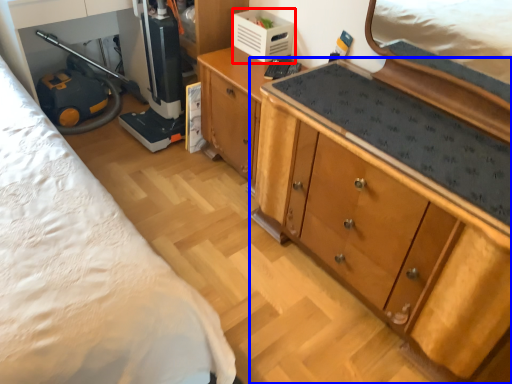
Question: Among these objects, which one is nearest to the camera, appliance (highlighted by a red box) or cabinetry (highlighted by a blue box)?

Choices:
 (A) appliance
 (B) cabinetry

Answer: (B)